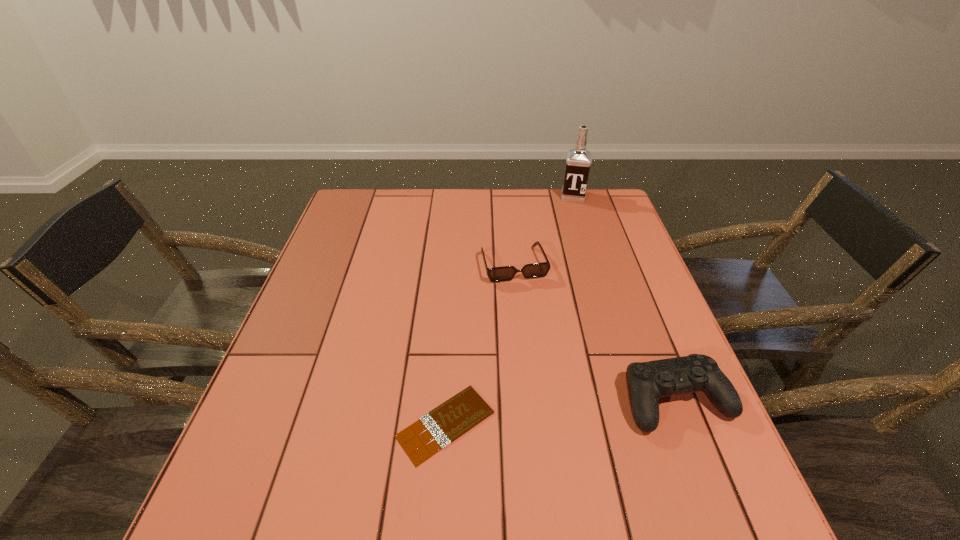
The height and width of the screenshot is (540, 960). I want to click on object located in the near right corner section of the desktop, so click(x=647, y=382).

Identify the location of vacant space at the far edge of the desktop. click(446, 217).

This screenshot has height=540, width=960. In order to click on vacant space at the near edge in this screenshot , I will do `click(618, 444)`.

Find the location of a particular element. The width and height of the screenshot is (960, 540). free spot at the left edge of the desktop is located at coordinates (364, 249).

Locate an element on the screen. free location at the right edge is located at coordinates (642, 275).

Where is `free spot at the far left corner of the desktop`? The image size is (960, 540). free spot at the far left corner of the desktop is located at coordinates (378, 214).

Locate an element on the screen. This screenshot has height=540, width=960. vacant space at the near right corner of the desktop is located at coordinates (671, 434).

You are a GUI agent. You are given a task and a screenshot of the screen. Output one action in this format:
    pyautogui.click(x=<x>, y=<y>)
    Task: Click on the empty location between the control and the tallest object
    
    Given the screenshot: What is the action you would take?
    pyautogui.click(x=625, y=298)

Find the location of `vacant space that is in between the vodka and the second tallest object`. vacant space that is in between the vodka and the second tallest object is located at coordinates (625, 298).

Identify the location of free space between the second shortest object and the vodka. This screenshot has height=540, width=960. coord(543,230).